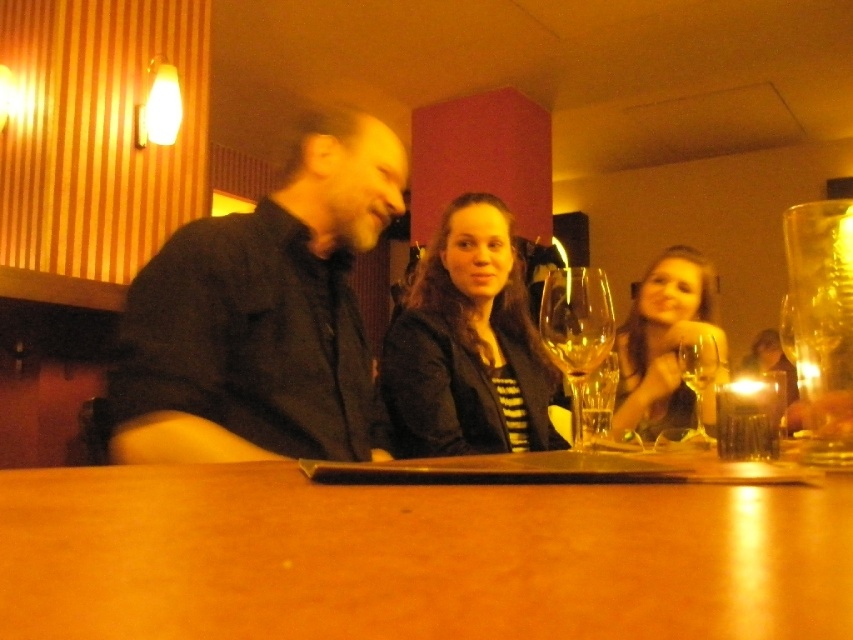
Question: Among these objects, which one is nearest to the camera?

Choices:
 (A) dark brown leather jacket at center
 (B) brown wooden table at center
 (C) translucent glass wine at center
 (D) transparent glass wine glass at right

Answer: (B)

Question: Which object is the farthest from the translucent glass candle at upper right?

Choices:
 (A) transparent glass wine glass at right
 (B) translucent glass wine at center
 (C) dark brown leather jacket at center

Answer: (C)

Question: Which point appears closest to the camera in this image?

Choices:
 (A) pos(679,294)
 (B) pos(587,420)
 (C) pos(556,284)
 (D) pos(714,346)

Answer: (C)

Question: Observing the image, what is the correct spatial positioning of translucent glass wine at center in reference to clear glass at center?

Choices:
 (A) left
 (B) right

Answer: (A)

Question: Can you confirm if dark brown leather jacket at center is positioned to the left of translucent glass wine at center?

Choices:
 (A) yes
 (B) no

Answer: (B)

Question: Is smooth black hair at upper right to the left of translucent glass candle at upper right from the viewer's perspective?

Choices:
 (A) no
 (B) yes

Answer: (A)